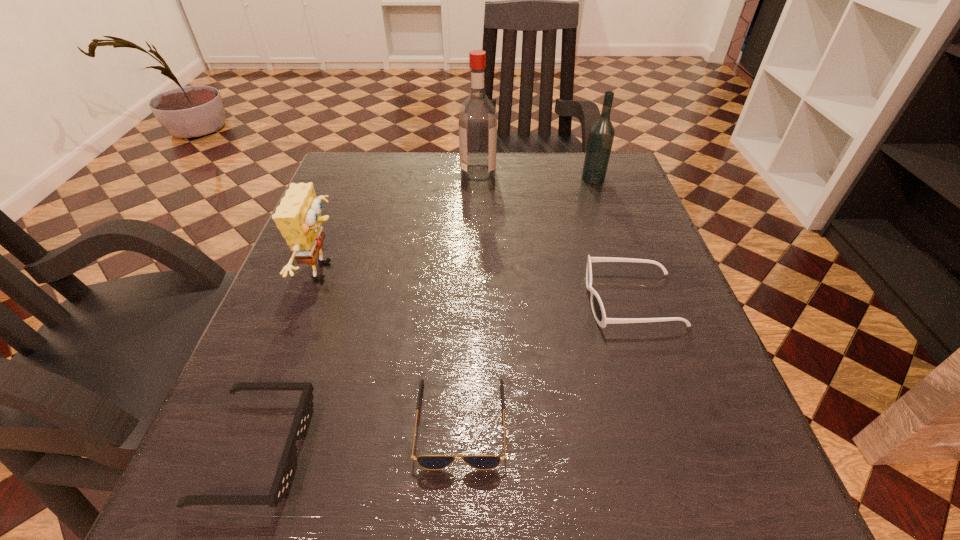
At what (x,y) coordinates should I click in order to perform the action: click on blank space located with the lenses of the rightmost sunglasses facing outward. Please return your answer as a coordinate pair (x, y). Looking at the image, I should click on (430, 300).

This screenshot has height=540, width=960. I want to click on vacant space situated with the lenses of the rightmost sunglasses facing outward, so click(553, 300).

Locate an element on the screen. The image size is (960, 540). vacant space located with the lenses of the rightmost sunglasses facing outward is located at coordinates (430, 300).

At what (x,y) coordinates should I click in order to perform the action: click on blank area located 0.130m on the front-facing side of the leftmost sunglasses. Please return your answer as a coordinate pair (x, y). The width and height of the screenshot is (960, 540). Looking at the image, I should click on (398, 450).

Where is `liquor situated at the far edge`? The height and width of the screenshot is (540, 960). liquor situated at the far edge is located at coordinates (477, 119).

At what (x,y) coordinates should I click in order to perform the action: click on vodka located at the far edge. Please return your answer as a coordinate pair (x, y). Looking at the image, I should click on (601, 135).

Identify the location of sponge at the left edge. The width and height of the screenshot is (960, 540). (298, 217).

Identify the location of sunglasses located at the left edge. (285, 473).

You are a GUI agent. You are given a task and a screenshot of the screen. Output one action in this format:
    pyautogui.click(x=<x>, y=<y>)
    Task: Click on the vodka that is at the right edge
    The image size is (960, 540).
    Given the screenshot: What is the action you would take?
    pyautogui.click(x=601, y=135)

Identify the location of sunglasses that is at the right edge. This screenshot has height=540, width=960. (x=598, y=310).